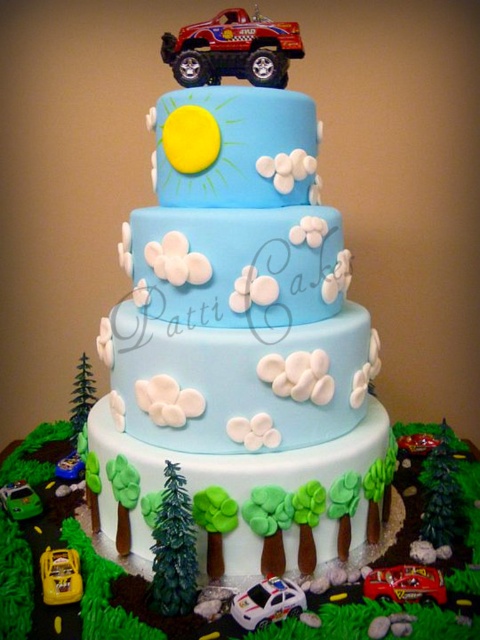
Question: Can you confirm if shiny red plastic truck at top is positioned to the right of metallic silver car at lower left?

Choices:
 (A) yes
 (B) no

Answer: (A)

Question: Among these objects, which one is farthest from the camera?

Choices:
 (A) metallic red car at center
 (B) blue fondant truck at upper center
 (C) shiny red plastic truck at top

Answer: (C)

Question: Which point is farther to the camera?

Choices:
 (A) (365, 588)
 (B) (41, 557)
 (C) (277, 584)
 (D) (202, 52)

Answer: (D)

Question: Which of the following is the closest to the observer?

Choices:
 (A) metallic red car at center
 (B) yellow plastic toy car at lower left
 (C) blue fondant truck at upper center

Answer: (A)

Question: Is shiny red plastic truck at top smaller than metallic silver car at lower left?

Choices:
 (A) yes
 (B) no

Answer: (B)

Question: Does metallic red car at center have a lesser width compared to yellow plastic toy car at lower left?

Choices:
 (A) yes
 (B) no

Answer: (B)